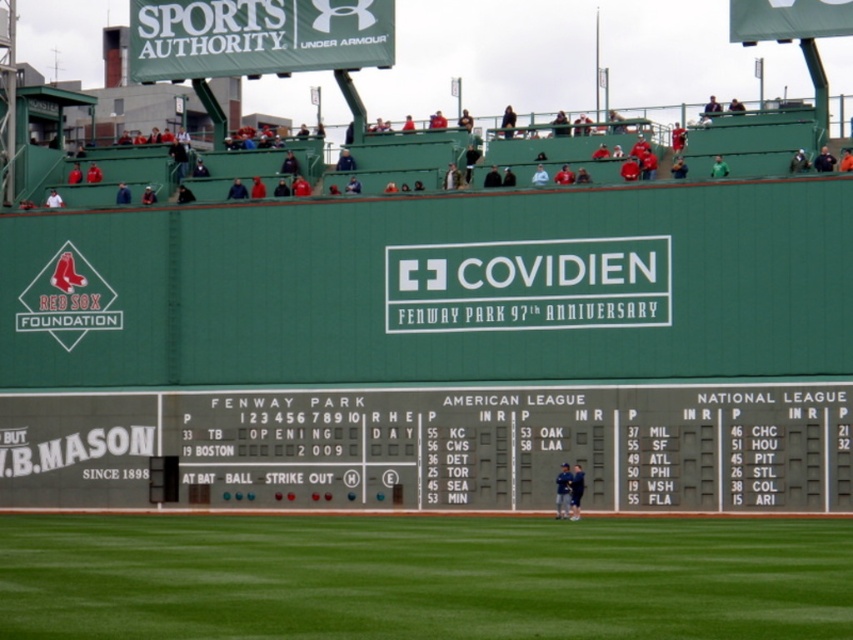
Question: Can you confirm if green grass at lower center is positioned to the left of gray metal scoreboard at center?

Choices:
 (A) no
 (B) yes

Answer: (A)

Question: Among these points, which one is farthest from the camera?

Choices:
 (A) (579, 474)
 (B) (781, 536)
 (C) (844, 410)

Answer: (C)

Question: Which of the following is the closest to the observer?

Choices:
 (A) gray metal scoreboard at center
 (B) dark blue uniform at center
 (C) blue uniform at center
 (D) green grass at lower center

Answer: (D)

Question: Can you confirm if green grass at lower center is positioned to the left of blue uniform at center?

Choices:
 (A) yes
 (B) no

Answer: (A)

Question: Considering the relative positions of green grass at lower center and gray metal scoreboard at center in the image provided, where is green grass at lower center located with respect to gray metal scoreboard at center?

Choices:
 (A) right
 (B) left

Answer: (A)

Question: Which of these objects is positioned farthest from the gray metal scoreboard at center?

Choices:
 (A) green grass at lower center
 (B) dark blue uniform at center

Answer: (A)